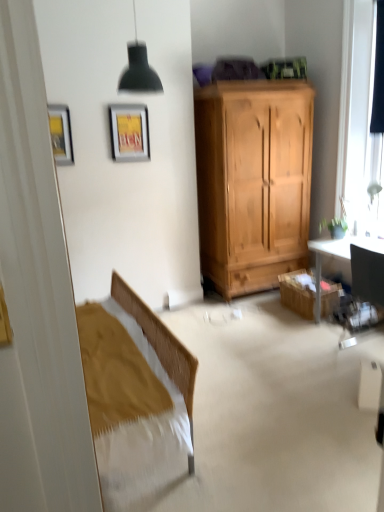
Question: Is wooden cabinet at lower right looking in the opposite direction of metallic silver picture frame at upper center, arranged as the first picture frame when viewed from the back?

Choices:
 (A) yes
 (B) no

Answer: (B)

Question: Is wooden cabinet at lower right positioned in front of metallic silver picture frame at upper center, placed as the first picture frame when sorted from right to left?

Choices:
 (A) no
 (B) yes

Answer: (A)

Question: Considering the relative sizes of wooden cabinet at lower right and metallic silver picture frame at upper center, which is the second picture frame from front to back, in the image provided, is wooden cabinet at lower right taller than metallic silver picture frame at upper center, which is the second picture frame from front to back,?

Choices:
 (A) no
 (B) yes

Answer: (A)

Question: From the image's perspective, is wooden cabinet at lower right under metallic silver picture frame at upper center, which is the second picture frame from front to back?

Choices:
 (A) no
 (B) yes

Answer: (B)

Question: Could you tell me if wooden cabinet at lower right is facing metallic silver picture frame at upper center, arranged as the first picture frame when viewed from the back?

Choices:
 (A) no
 (B) yes

Answer: (A)

Question: Does wooden cabinet at lower right have a larger size compared to metallic silver picture frame at upper center, placed as the first picture frame when sorted from right to left?

Choices:
 (A) yes
 (B) no

Answer: (A)

Question: Can you confirm if matte black lampshade at upper center is smaller than black fabric curtain at right?

Choices:
 (A) yes
 (B) no

Answer: (B)

Question: From the image's perspective, does matte black lampshade at upper center appear higher than black fabric curtain at right?

Choices:
 (A) no
 (B) yes

Answer: (A)

Question: Does matte black lampshade at upper center touch black fabric curtain at right?

Choices:
 (A) yes
 (B) no

Answer: (B)

Question: From the image's perspective, is matte black lampshade at upper center below black fabric curtain at right?

Choices:
 (A) yes
 (B) no

Answer: (A)

Question: Is matte black lampshade at upper center positioned with its back to black fabric curtain at right?

Choices:
 (A) no
 (B) yes

Answer: (A)

Question: From a real-world perspective, is matte black lampshade at upper center beneath black fabric curtain at right?

Choices:
 (A) no
 (B) yes

Answer: (A)

Question: Considering the relative sizes of wooden cabinet at lower right and black fabric curtain at right in the image provided, is wooden cabinet at lower right bigger than black fabric curtain at right?

Choices:
 (A) yes
 (B) no

Answer: (A)